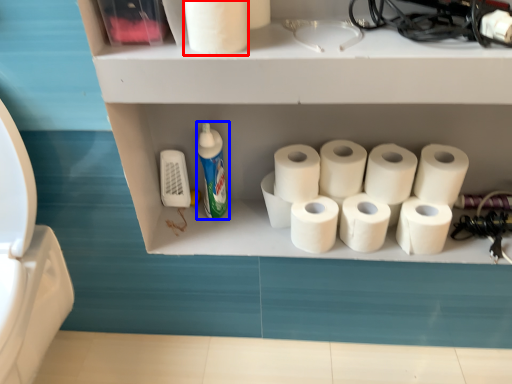
Question: Which of the following is the farthest to the observer, toilet paper (highlighted by a red box) or cleaning product (highlighted by a blue box)?

Choices:
 (A) toilet paper
 (B) cleaning product

Answer: (B)